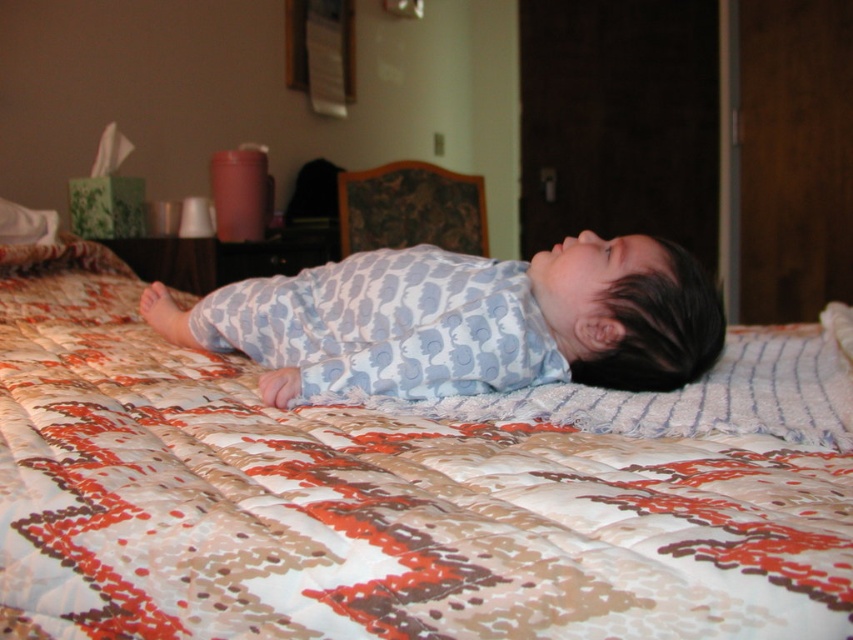
Question: Which of the following is the farthest from the observer?

Choices:
 (A) (590, 577)
 (B) (190, 340)

Answer: (B)

Question: Which point is closer to the camera taking this photo?

Choices:
 (A) (175, 461)
 (B) (334, 356)

Answer: (A)

Question: Does printed cotton quilt at center have a greater width compared to blue cotton onesie at center?

Choices:
 (A) yes
 (B) no

Answer: (A)

Question: Can you confirm if printed cotton quilt at center is wider than blue cotton onesie at center?

Choices:
 (A) no
 (B) yes

Answer: (B)

Question: Does printed cotton quilt at center appear on the left side of blue cotton onesie at center?

Choices:
 (A) yes
 (B) no

Answer: (A)